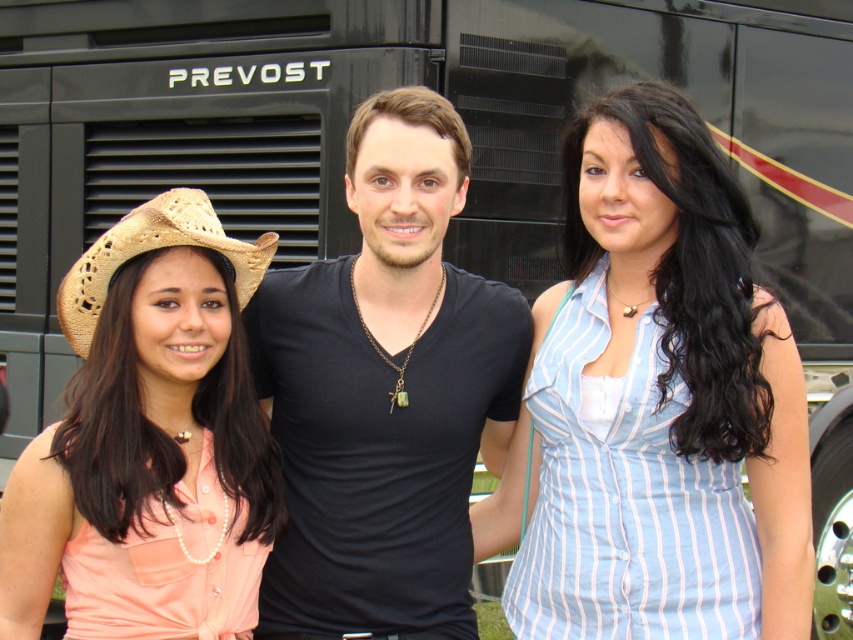
Question: Can you confirm if black matte shirt at center is wider than pink fabric shirt at left?

Choices:
 (A) yes
 (B) no

Answer: (A)

Question: Which object appears closest to the camera in this image?

Choices:
 (A) black matte shirt at center
 (B) light blue striped shirt at center
 (C) pink fabric shirt at left

Answer: (C)

Question: Is black matte shirt at center positioned in front of braided straw cowboy hat at left?

Choices:
 (A) yes
 (B) no

Answer: (B)

Question: Is light blue striped shirt at center in front of black matte shirt at center?

Choices:
 (A) no
 (B) yes

Answer: (B)

Question: Which point appears farthest from the camera in this image?

Choices:
 (A) (305, 605)
 (B) (160, 209)
 (C) (711, 336)
 (D) (73, 321)

Answer: (A)

Question: Which point appears closest to the camera in this image?

Choices:
 (A) (257, 244)
 (B) (410, 154)
 (C) (647, 294)

Answer: (A)